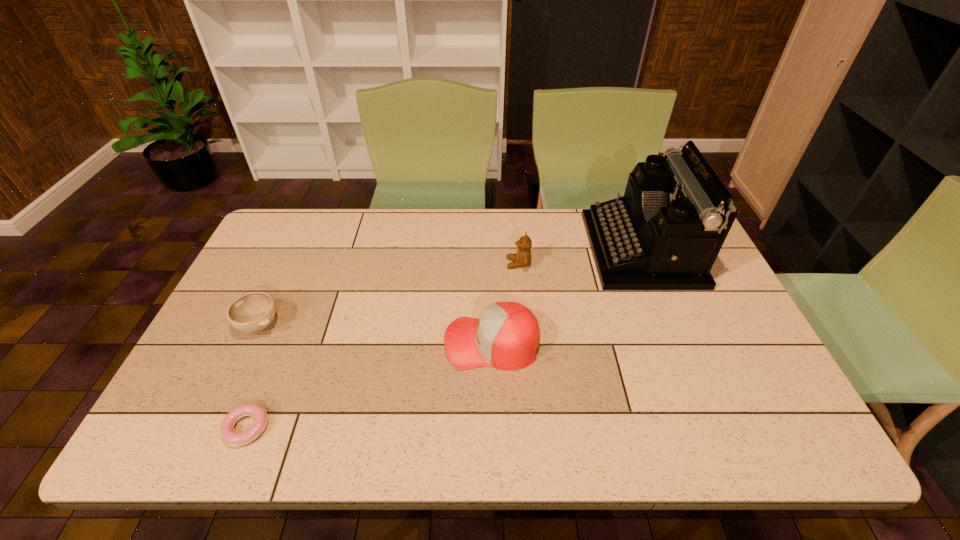
Where is `free space located on the front-facing side of the teddy bear`? free space located on the front-facing side of the teddy bear is located at coordinates (436, 264).

What are the coordinates of `vacant space located on the front-facing side of the teddy bear` in the screenshot? It's located at (443, 264).

Where is `free region located on the front-facing side of the teddy bear`? The width and height of the screenshot is (960, 540). free region located on the front-facing side of the teddy bear is located at coordinates (394, 264).

Image resolution: width=960 pixels, height=540 pixels. I want to click on free space located on the front-facing side of the baseball cap, so click(x=322, y=343).

This screenshot has height=540, width=960. In order to click on blank area located on the front-facing side of the baseball cap in this screenshot , I will do `click(406, 343)`.

You are a GUI agent. You are given a task and a screenshot of the screen. Output one action in this format:
    pyautogui.click(x=<x>, y=<y>)
    Task: Click on the free space located 0.210m on the front-facing side of the baseball cap
    
    Given the screenshot: What is the action you would take?
    pyautogui.click(x=364, y=343)

You are a GUI agent. You are given a task and a screenshot of the screen. Output one action in this format:
    pyautogui.click(x=<x>, y=<y>)
    Task: Click on the free spot located 0.260m on the right of the fourth tallest object
    
    Given the screenshot: What is the action you would take?
    [x=377, y=325]

Find the location of `vacant space situated 0.360m on the right of the doughnut`. vacant space situated 0.360m on the right of the doughnut is located at coordinates (430, 428).

Find the location of `typewriter located at the far edge`. typewriter located at the far edge is located at coordinates (665, 233).

Find the location of `teddy bear located at the far edge`. teddy bear located at the far edge is located at coordinates (522, 258).